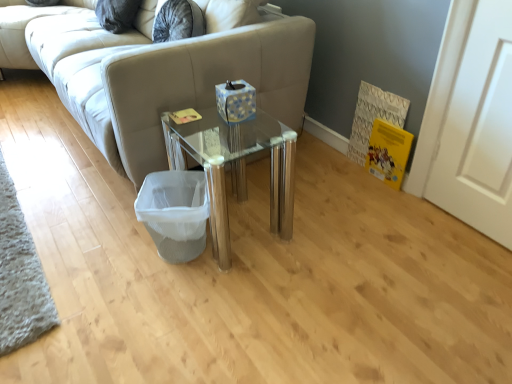
Question: From a real-world perspective, is beige fabric studio couch at center positioned under white mesh laundry basket at lower center based on gravity?

Choices:
 (A) no
 (B) yes

Answer: (A)

Question: Is beige fabric studio couch at center placed right next to white mesh laundry basket at lower center?

Choices:
 (A) no
 (B) yes

Answer: (A)

Question: Does beige fabric studio couch at center contain white mesh laundry basket at lower center?

Choices:
 (A) no
 (B) yes

Answer: (A)

Question: Is beige fabric studio couch at center smaller than white mesh laundry basket at lower center?

Choices:
 (A) no
 (B) yes

Answer: (A)

Question: From a real-world perspective, is beige fabric studio couch at center on top of white mesh laundry basket at lower center?

Choices:
 (A) yes
 (B) no

Answer: (A)

Question: Can we say beige fabric studio couch at center lies outside white mesh laundry basket at lower center?

Choices:
 (A) yes
 (B) no

Answer: (A)

Question: Can you confirm if transparent glass table at center is taller than beige fabric studio couch at center?

Choices:
 (A) yes
 (B) no

Answer: (B)

Question: From the image's perspective, does transparent glass table at center appear lower than beige fabric studio couch at center?

Choices:
 (A) no
 (B) yes

Answer: (B)

Question: Considering the relative sizes of transparent glass table at center and beige fabric studio couch at center in the image provided, is transparent glass table at center bigger than beige fabric studio couch at center?

Choices:
 (A) yes
 (B) no

Answer: (B)

Question: From the image's perspective, does transparent glass table at center appear higher than beige fabric studio couch at center?

Choices:
 (A) no
 (B) yes

Answer: (A)

Question: Can you confirm if transparent glass table at center is wider than beige fabric studio couch at center?

Choices:
 (A) yes
 (B) no

Answer: (B)

Question: Is transparent glass table at center located outside beige fabric studio couch at center?

Choices:
 (A) no
 (B) yes

Answer: (B)

Question: Is white mesh laundry basket at lower center outside transparent glass table at center?

Choices:
 (A) yes
 (B) no

Answer: (B)